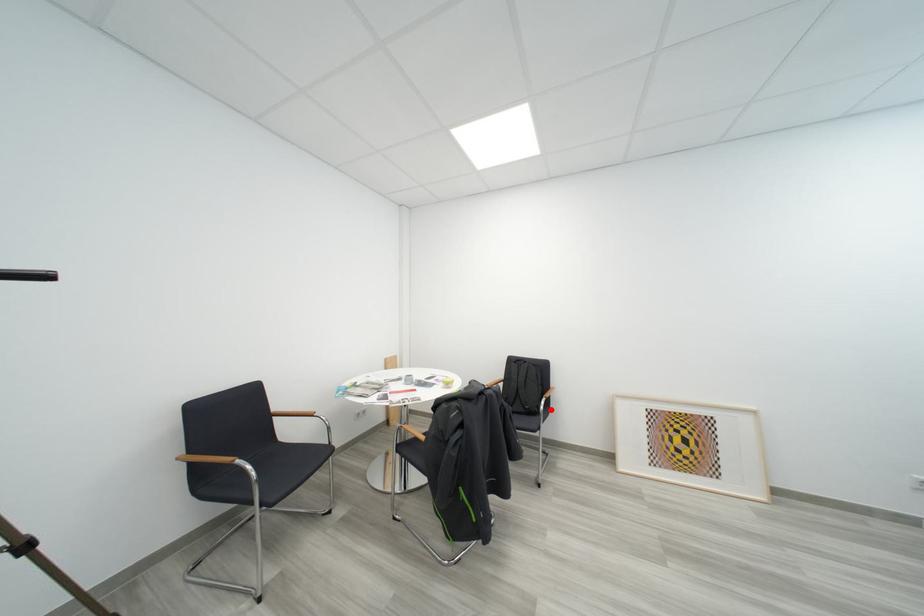
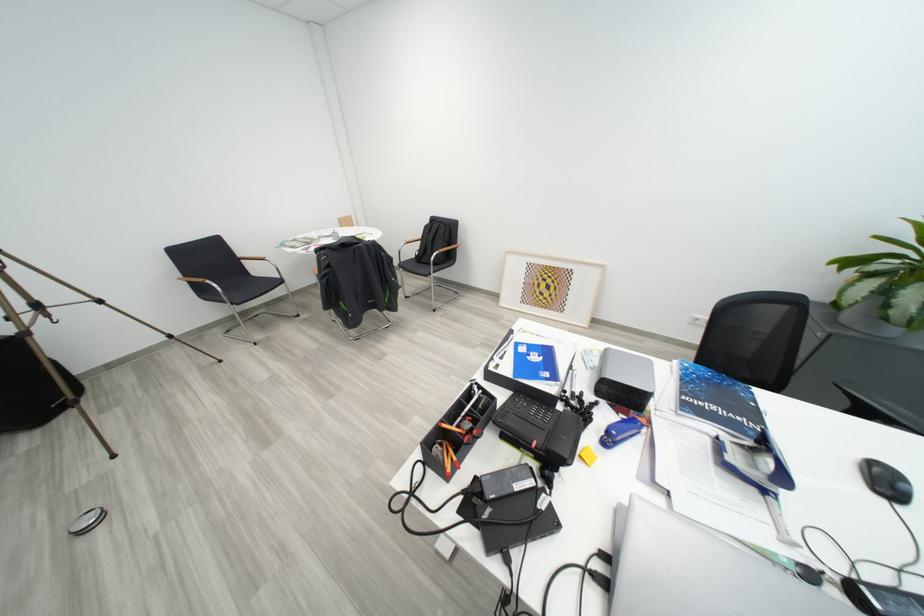
Question: I am providing you with two images of the same scene from different viewpoints. A red point is shown in image1. For the corresponding object point in image2, is it positioned nearer or farther from the camera?

Choices:
 (A) Nearer
 (B) Farther

Answer: (A)